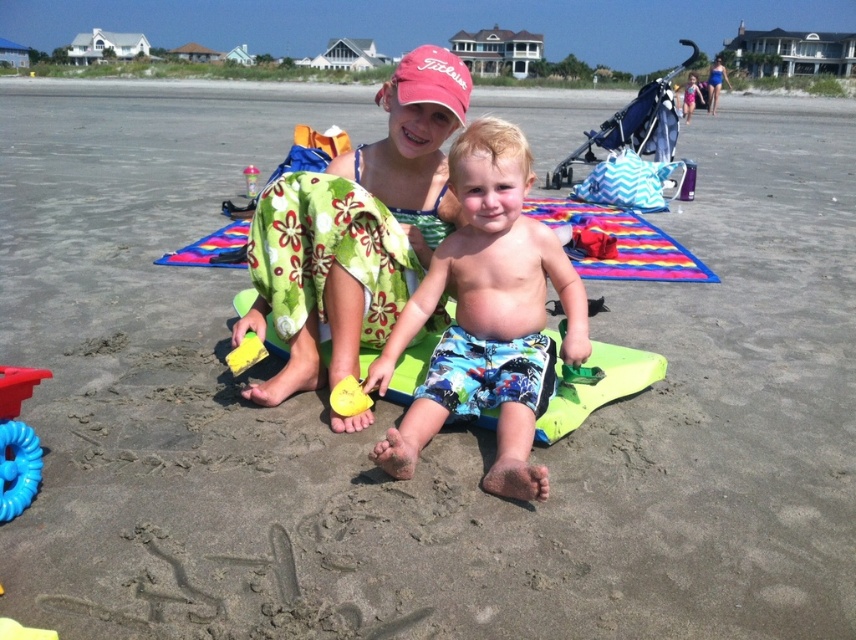
You are a parent at the beach and want to give your child a toy. You have a blue rubber ring at lower left and a yellow plastic shovel at center. Which one is smaller and more suitable for a toddler?

The blue rubber ring at lower left is smaller than the yellow plastic shovel at center, so it is more suitable for a toddler.

You are a parent at the beach and see your children playing with the rubber yellow toy at center and the yellow plastic shovel at center. Which one is more to the right?

The rubber yellow toy at center is positioned on the right side of the yellow plastic shovel at center, so the rubber yellow toy at center is more to the right.